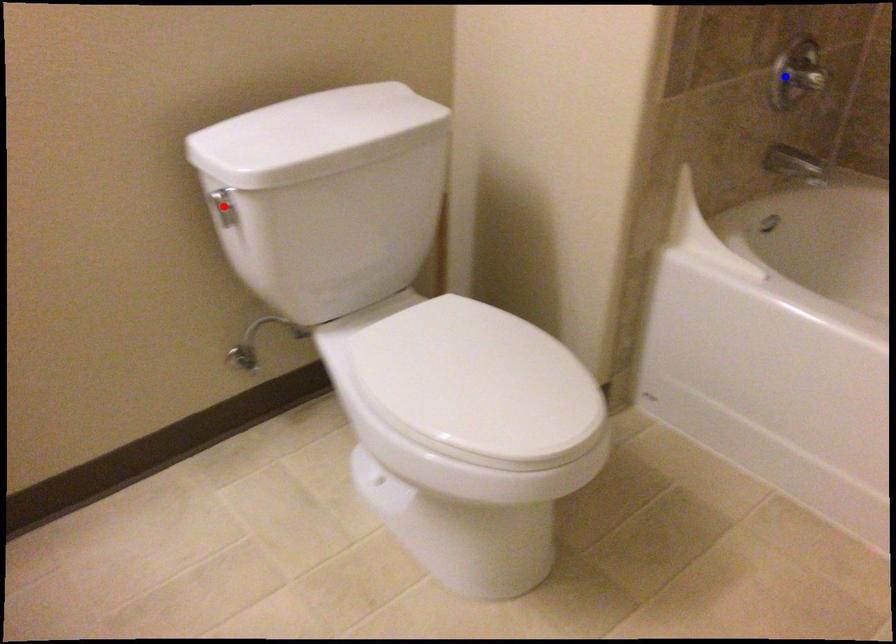
Question: Which of the two points in the image is closer to the camera?

Choices:
 (A) Blue point is closer.
 (B) Red point is closer.

Answer: (B)